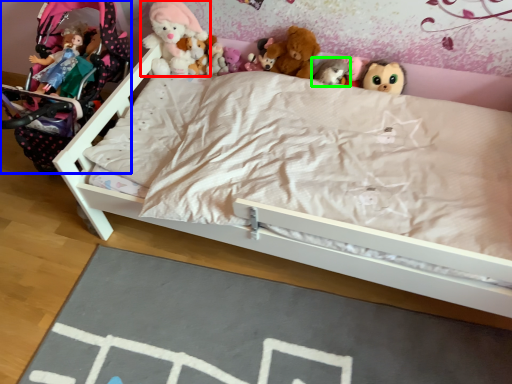
Question: Considering the real-world distances, which object is closest to toy (highlighted by a red box)? baby carriage (highlighted by a blue box) or toy (highlighted by a green box).

Choices:
 (A) baby carriage
 (B) toy

Answer: (A)